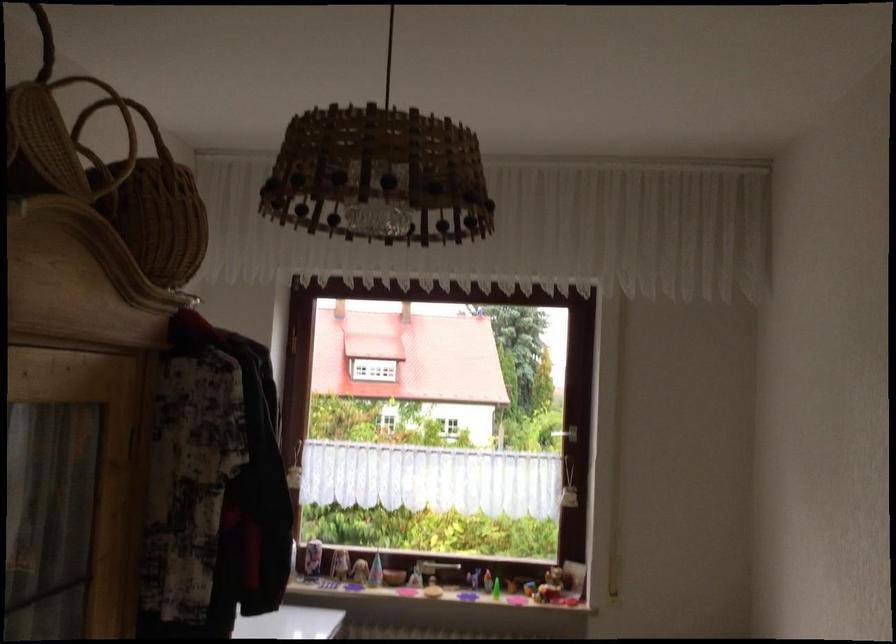
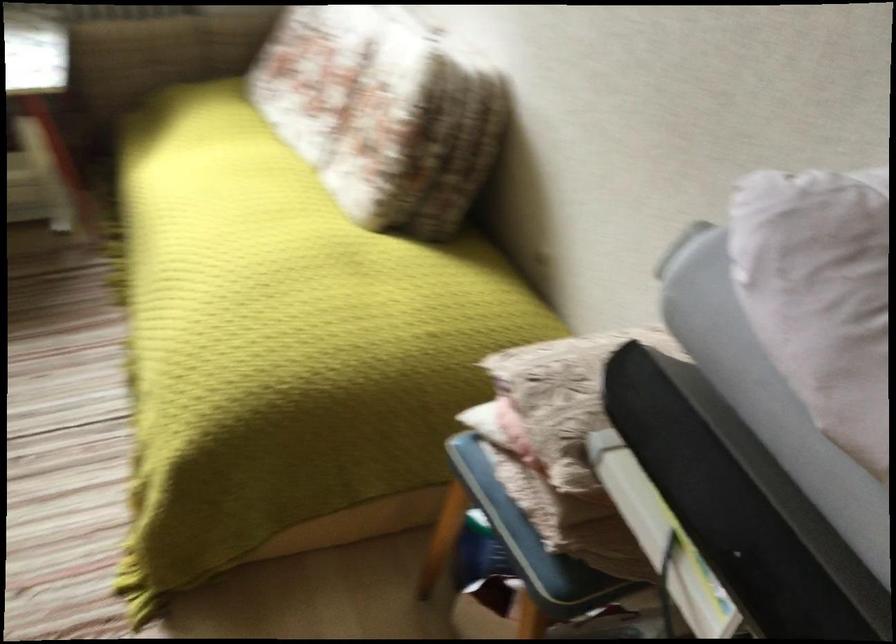
Based on the continuous images, in which direction is the camera rotating?

The camera rotated toward right-down.